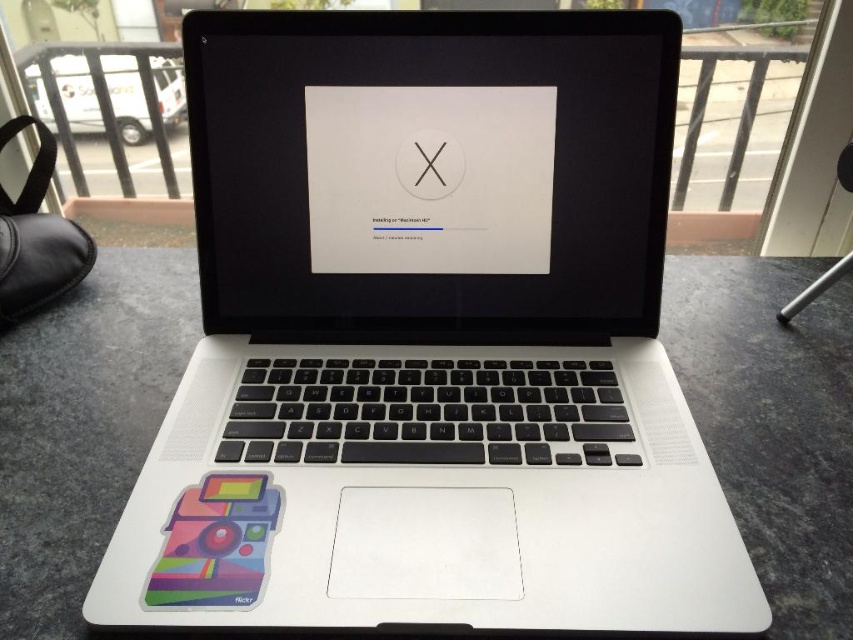
Question: Which point is farther to the camera?

Choices:
 (A) (212, 595)
 (B) (456, 168)
 (C) (253, 282)

Answer: (C)

Question: Which point is closer to the camera taking this photo?

Choices:
 (A) (225, 492)
 (B) (302, 321)
 (C) (433, 164)

Answer: (A)

Question: Does multicolored glossy sticker at lower left appear over black matte logo at center?

Choices:
 (A) no
 (B) yes

Answer: (A)

Question: Does multicolored glossy sticker at lower left appear over black matte logo at center?

Choices:
 (A) no
 (B) yes

Answer: (A)

Question: Which point is closer to the camera?

Choices:
 (A) (222, 128)
 (B) (428, 186)

Answer: (A)

Question: Where is satin black screen at center located in relation to black matte logo at center in the image?

Choices:
 (A) above
 (B) below

Answer: (B)